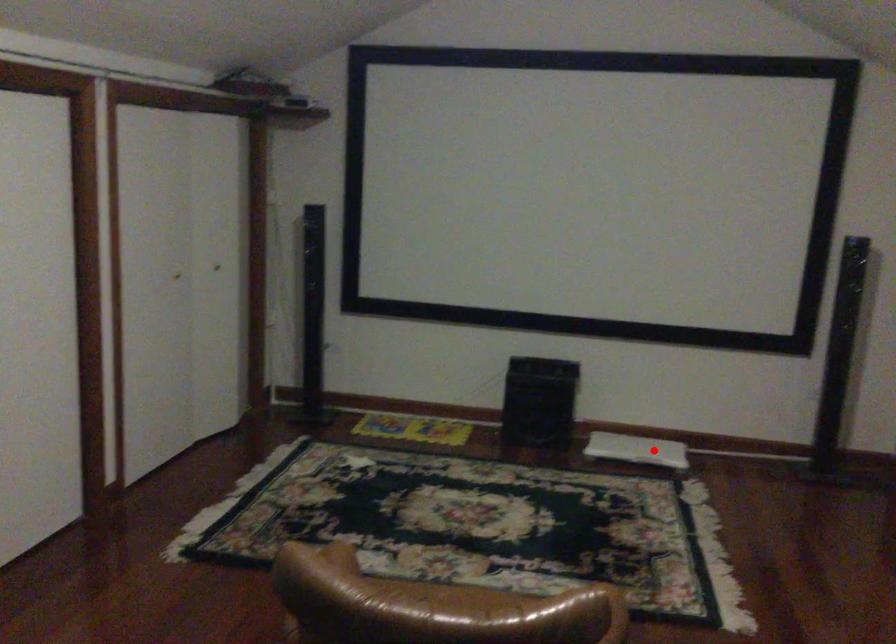
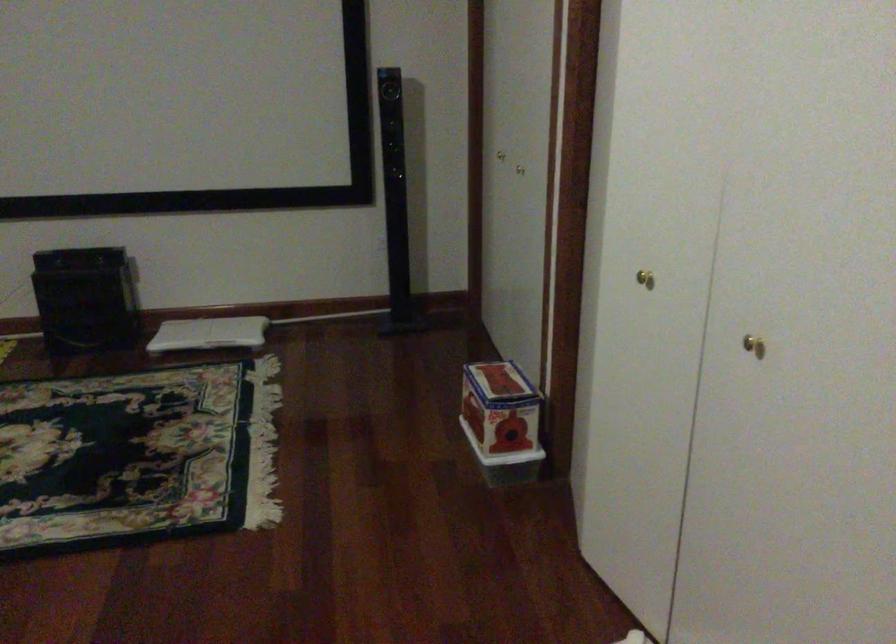
Find the pixel in the second image that matches the highlighted location in the first image.

(209, 333)